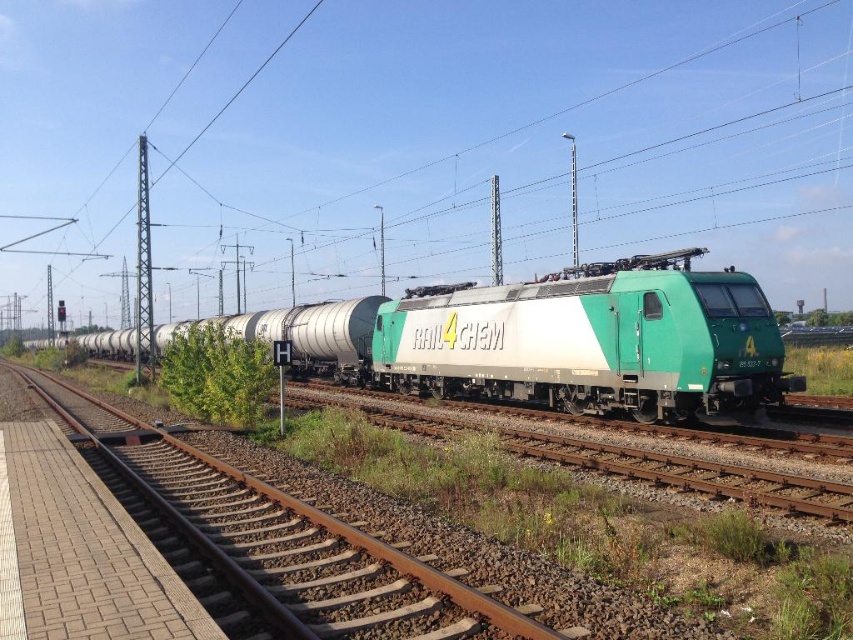
Question: Which point is farther from the camera taking this photo?

Choices:
 (A) (128, 436)
 (B) (672, 333)

Answer: (A)

Question: From the image, what is the correct spatial relationship of green matte train at center in relation to green metallic train track at center?

Choices:
 (A) above
 (B) below

Answer: (A)

Question: Which point is closer to the camera taking this photo?

Choices:
 (A) (248, 593)
 (B) (450, 346)

Answer: (A)

Question: Is green matte train at center to the left of green metallic train track at center from the viewer's perspective?

Choices:
 (A) no
 (B) yes

Answer: (B)

Question: Is the position of green matte train at center more distant than that of green metallic train track at center?

Choices:
 (A) yes
 (B) no

Answer: (A)